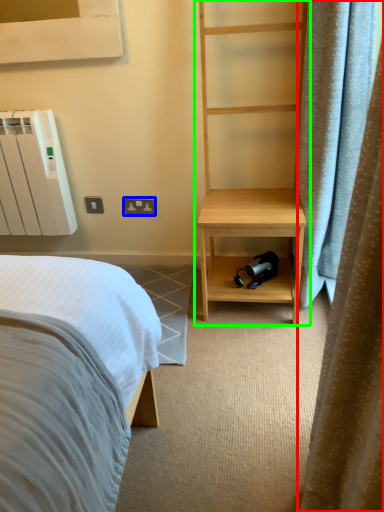
Question: Considering the real-world distances, which object is closest to curtain (highlighted by a red box)? electric outlet (highlighted by a blue box) or bookshelf (highlighted by a green box).

Choices:
 (A) electric outlet
 (B) bookshelf

Answer: (B)